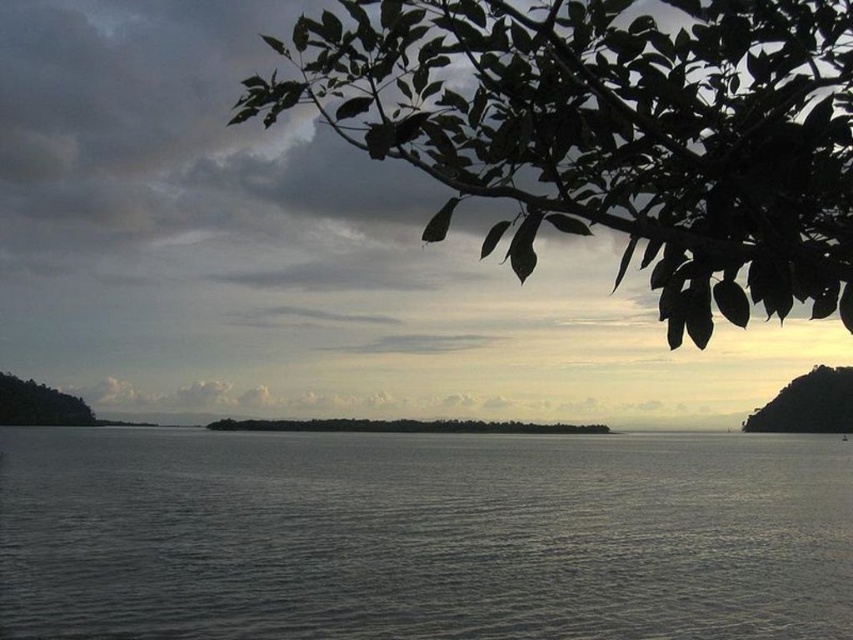
Question: Which of the following is the closest to the observer?

Choices:
 (A) (505, 472)
 (B) (399, 422)

Answer: (A)

Question: Which point is farther from the camera taking this photo?

Choices:
 (A) (633, 595)
 (B) (795, 396)
 (C) (351, 428)
 (D) (38, 406)

Answer: (B)

Question: Can you confirm if gray water at center is thinner than green leafy tree at center?

Choices:
 (A) no
 (B) yes

Answer: (A)

Question: Estimate the real-world distances between objects in this image. Which object is closer to the green leafy tree at left?

Choices:
 (A) green leafy tree at center
 (B) gray water at center
 (C) green leafy branch at upper right

Answer: (A)

Question: Is green leafy branch at upper right to the left of green leafy tree at left from the viewer's perspective?

Choices:
 (A) yes
 (B) no

Answer: (B)

Question: Is green leafy branch at upper right smaller than green leafy tree at left?

Choices:
 (A) yes
 (B) no

Answer: (A)